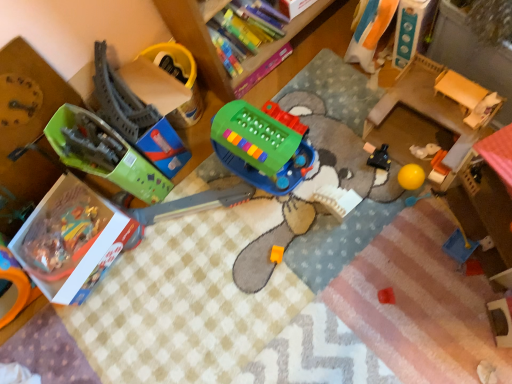
Where is `free space in front of green plastic toy at center, placed as the third toy when sorted from left to right`? free space in front of green plastic toy at center, placed as the third toy when sorted from left to right is located at coordinates (292, 238).